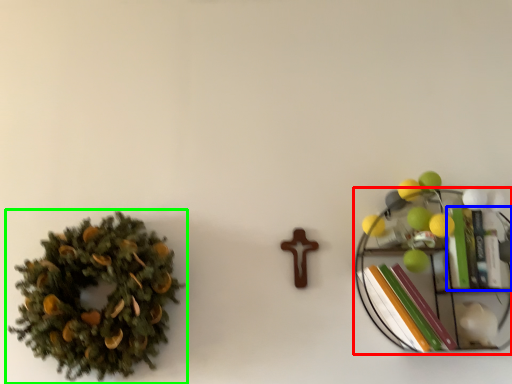
Question: Which is farther away from shelf (highlighted by a red box)? book (highlighted by a blue box) or houseplant (highlighted by a green box)?

Choices:
 (A) book
 (B) houseplant

Answer: (B)